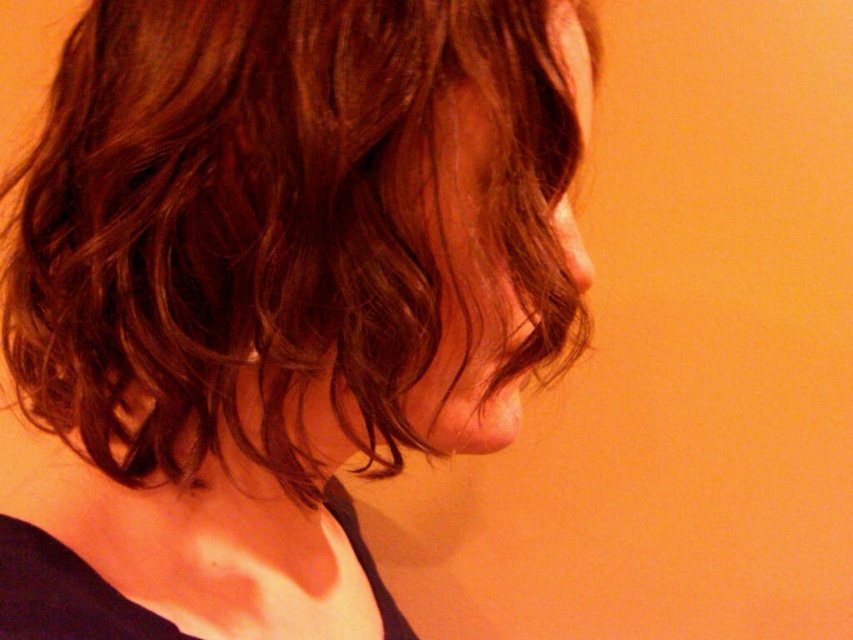
Please describe the position of the brown wavy hair at center in the image using the coordinate system where the bottom left corner is the origin point. The coordinate is represented as a pair of numbers between 0 and 1, with the first number indicating the horizontal position and the second number indicating the vertical position.

The brown wavy hair at center is located at coordinate point (x=276, y=296). The first number 0.464 indicates it is positioned 46.4 percent from the left edge towards the right edge horizontally, while the second number 0.324 means it is 32.4 percent from the bottom edge upwards vertically.

You are a hairstylist analyzing the image. You notice two sections of hair labeled as brown wavy hair at center and shiny brown hair at center. Which section is located to the left of the other?

The brown wavy hair at center is positioned on the left side of shiny brown hair at center.

From the picture: You are a photographer analyzing the composition of this image. You notice a point at coordinates (276, 296). What object in the image does this point correspond to?

The point at coordinates (276, 296) corresponds to the brown wavy hair at center.